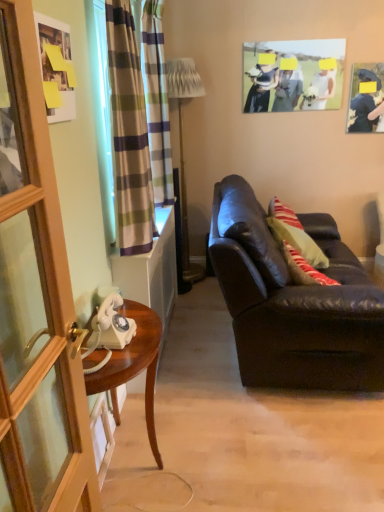
Question: From a real-world perspective, is plaid fabric curtain at left, placed as the first curtain when sorted from front to back, beneath matte black couch at right?

Choices:
 (A) no
 (B) yes

Answer: (A)

Question: Is plaid fabric curtain at left, acting as the 2th curtain starting from the back, taller than matte black couch at right?

Choices:
 (A) no
 (B) yes

Answer: (B)

Question: Considering the relative positions of plaid fabric curtain at left, acting as the 2th curtain starting from the back, and matte black couch at right in the image provided, is plaid fabric curtain at left, acting as the 2th curtain starting from the back, to the right of matte black couch at right from the viewer's perspective?

Choices:
 (A) yes
 (B) no

Answer: (B)

Question: Is there a large distance between plaid fabric curtain at left, placed as the first curtain when sorted from front to back, and matte black couch at right?

Choices:
 (A) no
 (B) yes

Answer: (A)

Question: Is plaid fabric curtain at left, acting as the 2th curtain starting from the back, next to matte black couch at right?

Choices:
 (A) yes
 (B) no

Answer: (B)

Question: In terms of height, does matte paper photo frame at upper center, which ranks as the 2th picture frame in right-to-left order, look taller or shorter compared to plaid fabric curtain at left, placed as the first curtain when sorted from front to back?

Choices:
 (A) tall
 (B) short

Answer: (B)

Question: From a real-world perspective, is matte paper photo frame at upper center, positioned as the third picture frame in bottom-to-top order, above or below plaid fabric curtain at left, acting as the 2th curtain starting from the back?

Choices:
 (A) above
 (B) below

Answer: (A)

Question: From the image's perspective, is matte paper photo frame at upper center, the 2th picture frame positioned from the back, located above or below plaid fabric curtain at left, placed as the first curtain when sorted from front to back?

Choices:
 (A) above
 (B) below

Answer: (A)

Question: Looking at their shapes, would you say matte paper photo frame at upper center, the first picture frame from the top, is wider or thinner than plaid fabric curtain at left, acting as the 2th curtain starting from the back?

Choices:
 (A) wide
 (B) thin

Answer: (B)

Question: Does point (162, 236) appear closer or farther from the camera than point (155, 108)?

Choices:
 (A) closer
 (B) farther

Answer: (B)

Question: Considering the positions of white glossy telephone at left and plaid fabric curtain at left, which ranks as the first curtain in back-to-front order, in the image, is white glossy telephone at left wider or thinner than plaid fabric curtain at left, which ranks as the first curtain in back-to-front order,?

Choices:
 (A) wide
 (B) thin

Answer: (A)

Question: From a real-world perspective, is white glossy telephone at left above or below plaid fabric curtain at left, which appears as the second curtain when viewed from the front?

Choices:
 (A) above
 (B) below

Answer: (B)

Question: Do you think white glossy telephone at left is within plaid fabric curtain at left, which ranks as the first curtain in back-to-front order, or outside of it?

Choices:
 (A) outside
 (B) inside

Answer: (A)

Question: Is metallic gold floor lamp at center inside or outside of matte paper photo frame at upper center, which is the second picture frame from front to back?

Choices:
 (A) inside
 (B) outside

Answer: (B)

Question: Considering the positions of point (180, 157) and point (246, 88), is point (180, 157) closer or farther from the camera than point (246, 88)?

Choices:
 (A) closer
 (B) farther

Answer: (B)